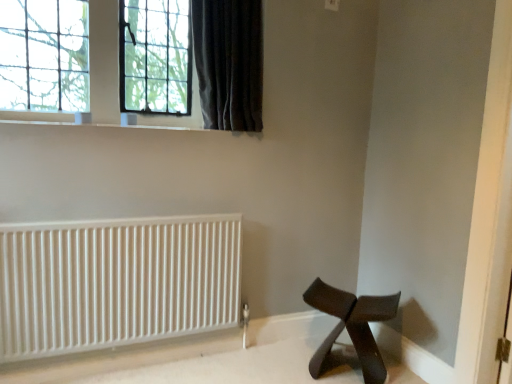
Locate an element on the screen. The image size is (512, 384). clear glass window at upper left is located at coordinates tap(104, 61).

Locate an element on the screen. The image size is (512, 384). white matte radiator at lower left is located at coordinates (116, 282).

What do you see at coordinates (345, 313) in the screenshot?
I see `black matte stool at lower right` at bounding box center [345, 313].

You are a GUI agent. You are given a task and a screenshot of the screen. Output one action in this format:
    pyautogui.click(x=<x>, y=<y>)
    Task: Click on the clear glass window at upper left
    The width and height of the screenshot is (512, 384).
    Given the screenshot: What is the action you would take?
    pyautogui.click(x=104, y=61)

Does clear glass window at upper left have a smaller size compared to dark velvet curtain at upper left?

Yes, clear glass window at upper left is smaller than dark velvet curtain at upper left.

Locate an element on the screen. The height and width of the screenshot is (384, 512). window behind the dark velvet curtain at upper left is located at coordinates (104, 61).

Is clear glass window at upper left directly adjacent to dark velvet curtain at upper left?

No, clear glass window at upper left is not next to dark velvet curtain at upper left.

Is white matte radiator at lower left far away from clear glass window at upper left?

No, white matte radiator at lower left is not far away from clear glass window at upper left.

In the image, is white matte radiator at lower left on the left side or the right side of clear glass window at upper left?

In the image, white matte radiator at lower left appears on the right side of clear glass window at upper left.

This screenshot has height=384, width=512. What are the coordinates of `radiator in front of the clear glass window at upper left` in the screenshot? It's located at click(116, 282).

Is black matte stool at lower right not close to dark velvet curtain at upper left?

Yes.

Considering the sizes of black matte stool at lower right and dark velvet curtain at upper left in the image, is black matte stool at lower right bigger or smaller than dark velvet curtain at upper left?

black matte stool at lower right is smaller than dark velvet curtain at upper left.

Which object is wider, black matte stool at lower right or dark velvet curtain at upper left?

black matte stool at lower right.

Between point (356, 319) and point (226, 32), which one is positioned in front?

Positioned in front is point (356, 319).

Is dark velvet curtain at upper left next to black matte stool at lower right and touching it?

No, dark velvet curtain at upper left is not touching black matte stool at lower right.

Considering the relative sizes of dark velvet curtain at upper left and black matte stool at lower right in the image provided, is dark velvet curtain at upper left shorter than black matte stool at lower right?

No.

From a real-world perspective, which object rests below the other?

black matte stool at lower right.

Does clear glass window at upper left have a greater width compared to white matte radiator at lower left?

Yes, clear glass window at upper left is wider than white matte radiator at lower left.

Is clear glass window at upper left at the left side of white matte radiator at lower left?

Correct, you'll find clear glass window at upper left to the left of white matte radiator at lower left.

How different are the orientations of clear glass window at upper left and white matte radiator at lower left in degrees?

They differ by 0.661 degrees in their facing directions.

Is clear glass window at upper left beside white matte radiator at lower left?

No, clear glass window at upper left is not making contact with white matte radiator at lower left.

Which is behind, point (192, 10) or point (199, 110)?

Point (199, 110)

Can you tell me how much dark velvet curtain at upper left and clear glass window at upper left differ in facing direction?

The angular difference between dark velvet curtain at upper left and clear glass window at upper left is 3.43 degrees.

Is dark velvet curtain at upper left facing away from clear glass window at upper left?

No, dark velvet curtain at upper left is not facing the opposite direction of clear glass window at upper left.

From the image's perspective, between dark velvet curtain at upper left and clear glass window at upper left, who is located below?

dark velvet curtain at upper left is shown below in the image.

Image resolution: width=512 pixels, height=384 pixels. I want to click on radiator on the left of dark velvet curtain at upper left, so click(116, 282).

From a real-world perspective, which object rests below the other?

In real-world perspective, white matte radiator at lower left is lower.

Is dark velvet curtain at upper left inside the boundaries of white matte radiator at lower left, or outside?

dark velvet curtain at upper left is not enclosed by white matte radiator at lower left.

Considering the sizes of objects dark velvet curtain at upper left and white matte radiator at lower left in the image provided, who is shorter, dark velvet curtain at upper left or white matte radiator at lower left?

dark velvet curtain at upper left is shorter.

Find the location of `curtain below the clear glass window at upper left (from the image's perspective)`. curtain below the clear glass window at upper left (from the image's perspective) is located at coordinates (229, 62).

The width and height of the screenshot is (512, 384). In order to click on radiator to the right of clear glass window at upper left in this screenshot , I will do `click(116, 282)`.

Looking at the image, which one is located further to white matte radiator at lower left, black matte stool at lower right or dark velvet curtain at upper left?

dark velvet curtain at upper left.

Based on their spatial positions, is clear glass window at upper left or dark velvet curtain at upper left further from black matte stool at lower right?

clear glass window at upper left is positioned further to the anchor black matte stool at lower right.

When comparing their distances from black matte stool at lower right, does white matte radiator at lower left or dark velvet curtain at upper left seem closer?

white matte radiator at lower left.

Which object lies nearer to the anchor point dark velvet curtain at upper left, black matte stool at lower right or white matte radiator at lower left?

white matte radiator at lower left.

From the image, which object appears to be farther from black matte stool at lower right, dark velvet curtain at upper left or white matte radiator at lower left?

dark velvet curtain at upper left.

Considering their positions, is white matte radiator at lower left positioned closer to dark velvet curtain at upper left than black matte stool at lower right?

white matte radiator at lower left is positioned closer to the anchor dark velvet curtain at upper left.

Considering their positions, is clear glass window at upper left positioned further to white matte radiator at lower left than dark velvet curtain at upper left?

dark velvet curtain at upper left lies further to white matte radiator at lower left than the other object.

Estimate the real-world distances between objects in this image. Which object is further from black matte stool at lower right, white matte radiator at lower left or clear glass window at upper left?

clear glass window at upper left.

Where is `radiator between clear glass window at upper left and black matte stool at lower right vertically`? This screenshot has width=512, height=384. radiator between clear glass window at upper left and black matte stool at lower right vertically is located at coordinates (116, 282).

Locate an element on the screen. Image resolution: width=512 pixels, height=384 pixels. curtain that lies between clear glass window at upper left and white matte radiator at lower left from top to bottom is located at coordinates [229, 62].

At what (x,y) coordinates should I click in order to perform the action: click on curtain between clear glass window at upper left and black matte stool at lower right vertically. Please return your answer as a coordinate pair (x, y). Looking at the image, I should click on (229, 62).

The width and height of the screenshot is (512, 384). I want to click on radiator between dark velvet curtain at upper left and black matte stool at lower right from top to bottom, so click(116, 282).